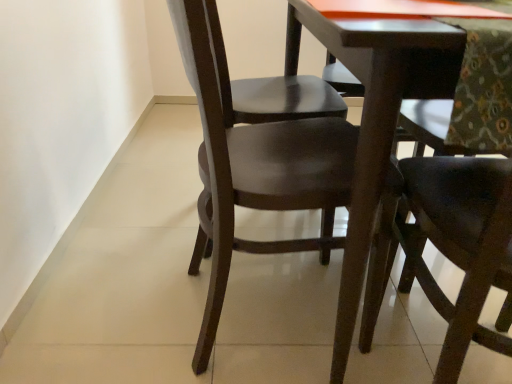
The width and height of the screenshot is (512, 384). Describe the element at coordinates (450, 247) in the screenshot. I see `dark wood chair at center, which ranks as the 2th chair in left-to-right order` at that location.

You are a GUI agent. You are given a task and a screenshot of the screen. Output one action in this format:
    pyautogui.click(x=<x>, y=<y>)
    Task: Click on the dark wood chair at center, positioned as the first chair in right-to-left order
    
    Given the screenshot: What is the action you would take?
    pyautogui.click(x=450, y=247)

At what (x,y) coordinates should I click in order to perform the action: click on glossy dark wood chair at center, marked as the 2th chair in a right-to-left arrangement. Please return your answer as a coordinate pair (x, y). The height and width of the screenshot is (384, 512). Looking at the image, I should click on (254, 170).

What do you see at coordinates (254, 170) in the screenshot?
I see `glossy dark wood chair at center, marked as the 2th chair in a right-to-left arrangement` at bounding box center [254, 170].

At what (x,y) coordinates should I click in order to perform the action: click on dark wood chair at center, which ranks as the 2th chair in left-to-right order. Please return your answer as a coordinate pair (x, y). This screenshot has width=512, height=384. Looking at the image, I should click on (450, 247).

Based on their positions, is glossy dark wood chair at center, marked as the 2th chair in a right-to-left arrangement, located to the left or right of dark wood chair at center, which ranks as the 2th chair in left-to-right order?

In the image, glossy dark wood chair at center, marked as the 2th chair in a right-to-left arrangement, appears on the left side of dark wood chair at center, which ranks as the 2th chair in left-to-right order.

Does glossy dark wood chair at center, the 1th chair when ordered from left to right, lie behind dark wood chair at center, positioned as the first chair in right-to-left order?

Yes, glossy dark wood chair at center, the 1th chair when ordered from left to right, is further from the camera.

Considering the positions of point (278, 186) and point (464, 206), is point (278, 186) closer or farther from the camera than point (464, 206)?

Clearly, point (278, 186) is more distant from the camera than point (464, 206).

From the image's perspective, between glossy dark wood chair at center, marked as the 2th chair in a right-to-left arrangement, and dark wood chair at center, positioned as the first chair in right-to-left order, which one is located above?

glossy dark wood chair at center, marked as the 2th chair in a right-to-left arrangement, is shown above in the image.

In the scene shown: From a real-world perspective, is glossy dark wood chair at center, marked as the 2th chair in a right-to-left arrangement, beneath dark wood chair at center, positioned as the first chair in right-to-left order?

No, from a real-world perspective, glossy dark wood chair at center, marked as the 2th chair in a right-to-left arrangement, is not beneath dark wood chair at center, positioned as the first chair in right-to-left order.

Considering the relative sizes of glossy dark wood chair at center, the 1th chair when ordered from left to right, and dark wood chair at center, which ranks as the 2th chair in left-to-right order, in the image provided, is glossy dark wood chair at center, the 1th chair when ordered from left to right, thinner than dark wood chair at center, which ranks as the 2th chair in left-to-right order,?

In fact, glossy dark wood chair at center, the 1th chair when ordered from left to right, might be wider than dark wood chair at center, which ranks as the 2th chair in left-to-right order.

Considering the relative sizes of glossy dark wood chair at center, marked as the 2th chair in a right-to-left arrangement, and dark wood chair at center, positioned as the first chair in right-to-left order, in the image provided, is glossy dark wood chair at center, marked as the 2th chair in a right-to-left arrangement, taller than dark wood chair at center, positioned as the first chair in right-to-left order,?

No.

Consider the image. Is glossy dark wood chair at center, the 1th chair when ordered from left to right, smaller than dark wood chair at center, which ranks as the 2th chair in left-to-right order?

Yes, glossy dark wood chair at center, the 1th chair when ordered from left to right, is smaller than dark wood chair at center, which ranks as the 2th chair in left-to-right order.

Is glossy dark wood chair at center, marked as the 2th chair in a right-to-left arrangement, located outside dark wood chair at center, which ranks as the 2th chair in left-to-right order?

glossy dark wood chair at center, marked as the 2th chair in a right-to-left arrangement, is positioned outside dark wood chair at center, which ranks as the 2th chair in left-to-right order.

Are glossy dark wood chair at center, the 1th chair when ordered from left to right, and dark wood chair at center, positioned as the first chair in right-to-left order, far apart?

No, glossy dark wood chair at center, the 1th chair when ordered from left to right, is in close proximity to dark wood chair at center, positioned as the first chair in right-to-left order.

Is glossy dark wood chair at center, the 1th chair when ordered from left to right, oriented towards dark wood chair at center, positioned as the first chair in right-to-left order?

No, glossy dark wood chair at center, the 1th chair when ordered from left to right, is not oriented towards dark wood chair at center, positioned as the first chair in right-to-left order.

How many degrees apart are the facing directions of glossy dark wood chair at center, the 1th chair when ordered from left to right, and dark wood chair at center, which ranks as the 2th chair in left-to-right order?

The angle between the facing direction of glossy dark wood chair at center, the 1th chair when ordered from left to right, and the facing direction of dark wood chair at center, which ranks as the 2th chair in left-to-right order, is 75.1 degrees.

You are a GUI agent. You are given a task and a screenshot of the screen. Output one action in this format:
    pyautogui.click(x=<x>, y=<y>)
    Task: Click on the chair that appears below the glossy dark wood chair at center, the 1th chair when ordered from left to right (from the image's perspective)
    The image size is (512, 384).
    Given the screenshot: What is the action you would take?
    pyautogui.click(x=450, y=247)

Considering the positions of objects dark wood chair at center, positioned as the first chair in right-to-left order, and glossy dark wood chair at center, the 1th chair when ordered from left to right, in the image provided, who is more to the left, dark wood chair at center, positioned as the first chair in right-to-left order, or glossy dark wood chair at center, the 1th chair when ordered from left to right,?

From the viewer's perspective, glossy dark wood chair at center, the 1th chair when ordered from left to right, appears more on the left side.

Is dark wood chair at center, positioned as the first chair in right-to-left order, further to camera compared to glossy dark wood chair at center, the 1th chair when ordered from left to right?

No, dark wood chair at center, positioned as the first chair in right-to-left order, is closer to the viewer.

Between point (481, 281) and point (332, 146), which one is positioned in front?

The point (481, 281) is closer to the camera.

From the image's perspective, is dark wood chair at center, positioned as the first chair in right-to-left order, on glossy dark wood chair at center, marked as the 2th chair in a right-to-left arrangement?

No.

From a real-world perspective, is dark wood chair at center, positioned as the first chair in right-to-left order, positioned above or below glossy dark wood chair at center, marked as the 2th chair in a right-to-left arrangement?

dark wood chair at center, positioned as the first chair in right-to-left order, is below glossy dark wood chair at center, marked as the 2th chair in a right-to-left arrangement.

Between dark wood chair at center, positioned as the first chair in right-to-left order, and glossy dark wood chair at center, marked as the 2th chair in a right-to-left arrangement, which one has larger width?

glossy dark wood chair at center, marked as the 2th chair in a right-to-left arrangement.

Considering the sizes of objects dark wood chair at center, positioned as the first chair in right-to-left order, and glossy dark wood chair at center, marked as the 2th chair in a right-to-left arrangement, in the image provided, who is shorter, dark wood chair at center, positioned as the first chair in right-to-left order, or glossy dark wood chair at center, marked as the 2th chair in a right-to-left arrangement,?

glossy dark wood chair at center, marked as the 2th chair in a right-to-left arrangement, is shorter.

Can you confirm if dark wood chair at center, positioned as the first chair in right-to-left order, is bigger than glossy dark wood chair at center, marked as the 2th chair in a right-to-left arrangement?

Yes, dark wood chair at center, positioned as the first chair in right-to-left order, is bigger than glossy dark wood chair at center, marked as the 2th chair in a right-to-left arrangement.

Is dark wood chair at center, positioned as the first chair in right-to-left order, not inside glossy dark wood chair at center, marked as the 2th chair in a right-to-left arrangement?

Yes, dark wood chair at center, positioned as the first chair in right-to-left order, is located beyond the bounds of glossy dark wood chair at center, marked as the 2th chair in a right-to-left arrangement.

Are dark wood chair at center, which ranks as the 2th chair in left-to-right order, and glossy dark wood chair at center, marked as the 2th chair in a right-to-left arrangement, located far from each other?

dark wood chair at center, which ranks as the 2th chair in left-to-right order, is actually quite close to glossy dark wood chair at center, marked as the 2th chair in a right-to-left arrangement.

Is dark wood chair at center, which ranks as the 2th chair in left-to-right order, positioned with its back to glossy dark wood chair at center, the 1th chair when ordered from left to right?

dark wood chair at center, which ranks as the 2th chair in left-to-right order, is not turned away from glossy dark wood chair at center, the 1th chair when ordered from left to right.

Based on the photo, can you tell me how much dark wood chair at center, positioned as the first chair in right-to-left order, and glossy dark wood chair at center, marked as the 2th chair in a right-to-left arrangement, differ in facing direction?

dark wood chair at center, positioned as the first chair in right-to-left order, and glossy dark wood chair at center, marked as the 2th chair in a right-to-left arrangement, are facing 75.1 degrees away from each other.

Where is `chair above the dark wood chair at center, which ranks as the 2th chair in left-to-right order (from the image's perspective)`? The width and height of the screenshot is (512, 384). chair above the dark wood chair at center, which ranks as the 2th chair in left-to-right order (from the image's perspective) is located at coordinates (254, 170).

Find the location of a particular element. The width and height of the screenshot is (512, 384). chair that appears below the glossy dark wood chair at center, the 1th chair when ordered from left to right (from the image's perspective) is located at coordinates (450, 247).

At what (x,y) coordinates should I click in order to perform the action: click on chair above the dark wood chair at center, positioned as the first chair in right-to-left order (from a real-world perspective). Please return your answer as a coordinate pair (x, y). Looking at the image, I should click on (254, 170).